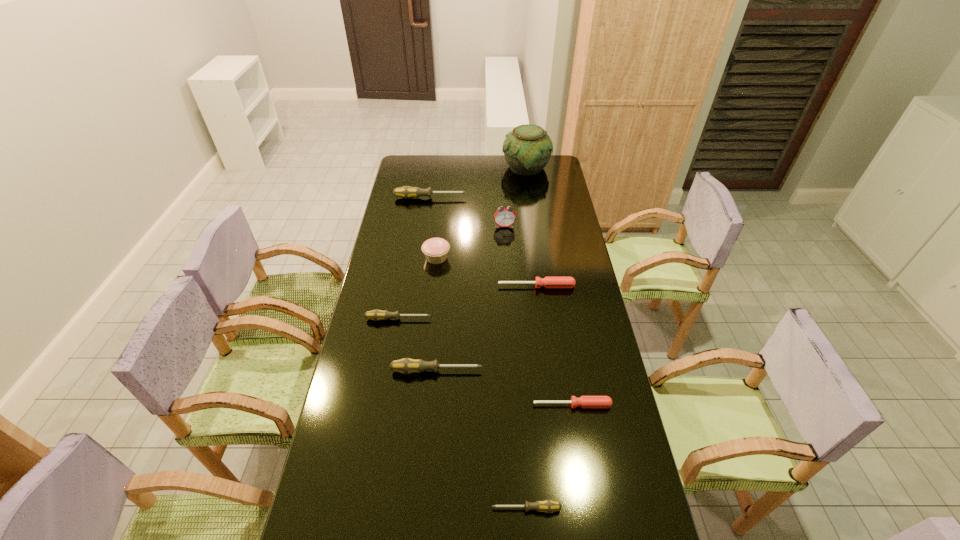
At what (x,y) coordinates should I click in order to perform the action: click on unoccupied area between the second tallest screwdriver and the cupcake. Please return your answer as a coordinate pair (x, y). The image size is (960, 540). Looking at the image, I should click on (437, 314).

The width and height of the screenshot is (960, 540). I want to click on free spot between the nearest screwdriver and the fifth shortest screwdriver, so click(481, 440).

Identify the location of free point between the alarm clock and the farthest object. The width and height of the screenshot is (960, 540). (516, 197).

Where is `object that ranks as the eighth closest to the smaller red screwdriver`? object that ranks as the eighth closest to the smaller red screwdriver is located at coordinates (527, 149).

Identify which object is located as the nearest to the eighth nearest object. Please provide its 2D coordinates. Your answer should be formatted as a tuple, i.e. [(x, y)], where the tuple contains the x and y coordinates of a point satisfying the conditions above.

[(504, 217)]

Where is `screwdriver that can be found as the fourth closest to the rightmost gray screwdriver`? This screenshot has height=540, width=960. screwdriver that can be found as the fourth closest to the rightmost gray screwdriver is located at coordinates (548, 282).

Identify the location of screwdriver that is the third closest to the second tallest screwdriver. This screenshot has width=960, height=540. (548, 282).

Identify which gray screwdriver is located as the fourth nearest to the farthest object. Please provide its 2D coordinates. Your answer should be formatted as a tuple, i.e. [(x, y)], where the tuple contains the x and y coordinates of a point satisfying the conditions above.

[(548, 506)]

You are a GUI agent. You are given a task and a screenshot of the screen. Output one action in this format:
    pyautogui.click(x=<x>, y=<y>)
    Task: Click on the gray screwdriver that is the third closest to the farther red screwdriver
    The width and height of the screenshot is (960, 540).
    Given the screenshot: What is the action you would take?
    pyautogui.click(x=406, y=192)

Identify which red screwdriver is the closest to the alarm clock. Please provide its 2D coordinates. Your answer should be formatted as a tuple, i.e. [(x, y)], where the tuple contains the x and y coordinates of a point satisfying the conditions above.

[(548, 282)]